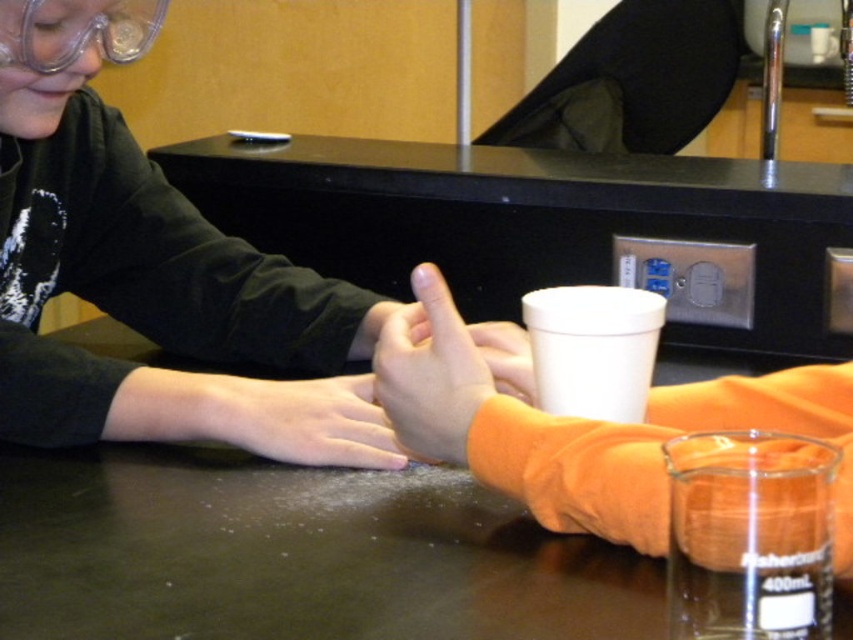
You are a researcher in a lab who needs to reach both the orange fabric hand at center and the clear plastic goggles at upper left. Given that your arm can extend 40 centimeters, will you be able to reach both items without moving your body?

The distance between the orange fabric hand at center and the clear plastic goggles at upper left is 39.78 centimeters, so yes, your arm can reach both items since the distance is within the 40 centimeter limit.

Based on the scene described, which object is positioned to the right of the other? The smooth skin hand at center or the clear plastic goggles at upper left?

The smooth skin hand at center is to the right of the clear plastic goggles at upper left.

You are a safety inspector in the lab. You need to ensure that the orange fabric hand at center and the clear plastic goggles at upper left are positioned correctly according to safety protocols. Which object should be placed higher to comply with the safety rule that requires the hand to be above the goggles?

The orange fabric hand at center should be placed higher than the clear plastic goggles at upper left because the orange fabric hand at center has a greater height compared to clear plastic goggles at upper left.